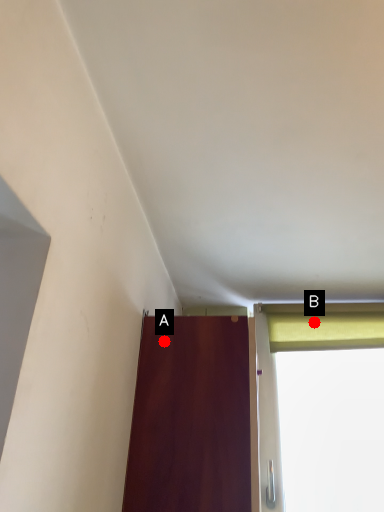
Question: Two points are circled on the image, labeled by A and B beside each circle. Which point is farther to the camera?

Choices:
 (A) A is further
 (B) B is further

Answer: (B)